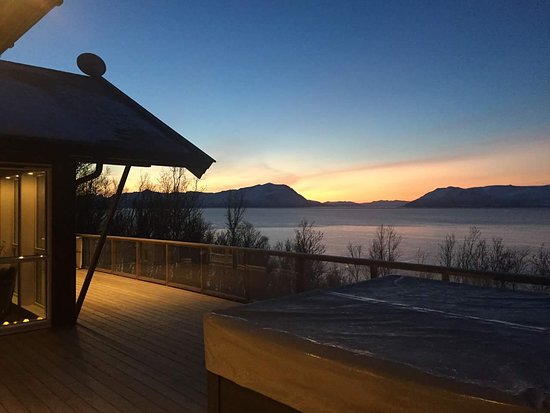
Where is `window`? window is located at coordinates (18, 216).